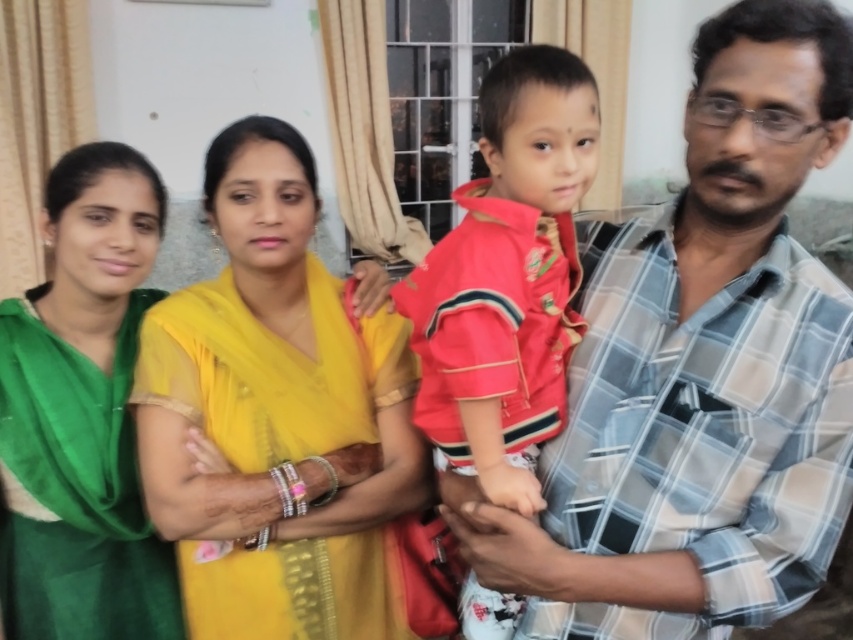
Can you confirm if plaid cotton shirt at center is smaller than yellow sheer saree at center?

No.

Who is more forward, (508, 577) or (184, 545)?

Point (508, 577) is in front.

Is point (782, 376) less distant than point (378, 426)?

That is True.

The image size is (853, 640). In order to click on plaid cotton shirt at center in this screenshot , I will do `click(700, 371)`.

Does plaid cotton shirt at center have a larger size compared to green silk saree at upper left?

Yes.

The height and width of the screenshot is (640, 853). Find the location of `plaid cotton shirt at center`. plaid cotton shirt at center is located at coordinates (700, 371).

Who is more distant from viewer, (x=813, y=273) or (x=105, y=333)?

The point (x=105, y=333) is behind.

What are the coordinates of `plaid cotton shirt at center` in the screenshot? It's located at (700, 371).

Does plaid cotton shirt at center appear on the left side of red cotton shirt at center?

No, plaid cotton shirt at center is not to the left of red cotton shirt at center.

From the picture: Does plaid cotton shirt at center have a lesser height compared to red cotton shirt at center?

Indeed, plaid cotton shirt at center has a lesser height compared to red cotton shirt at center.

Is point (491, 547) behind point (555, 48)?

No, (491, 547) is in front of (555, 48).

Identify the location of plaid cotton shirt at center. (700, 371).